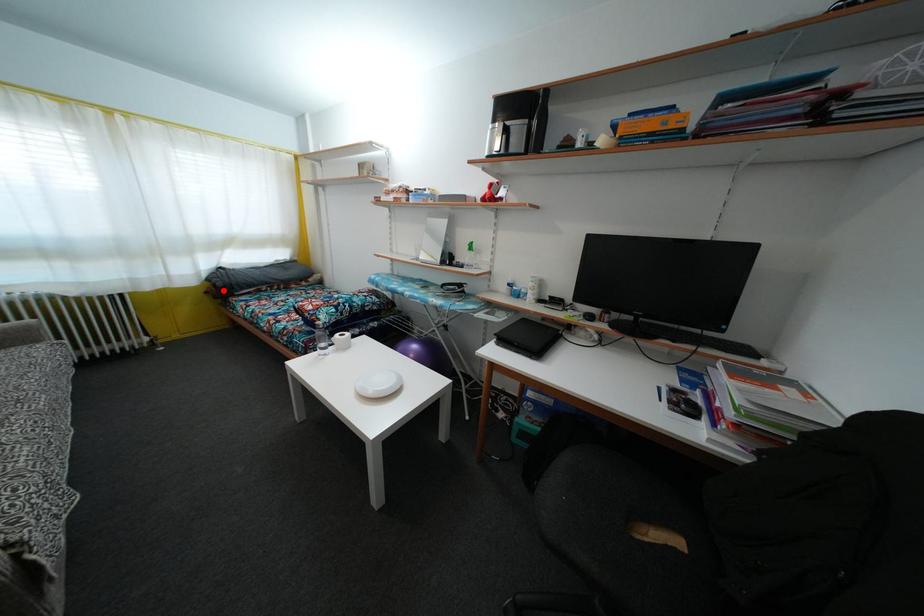
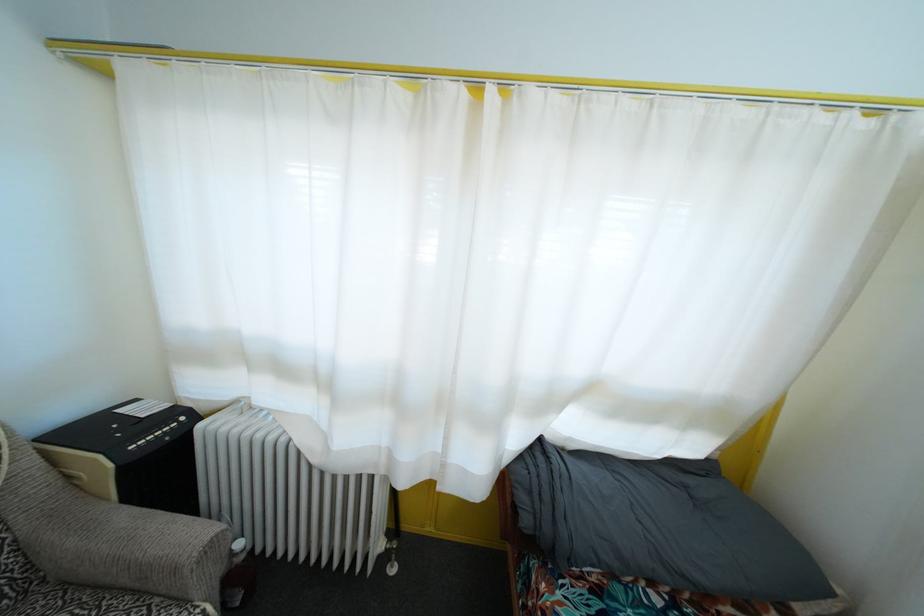
Question: I am providing you with two images of the same scene from different viewpoints. Image1 has a red point marked. In image2, the corresponding 3D location appears at what relative position? Reply with the corresponding letter.

Choices:
 (A) Closer
 (B) Farther

Answer: (B)